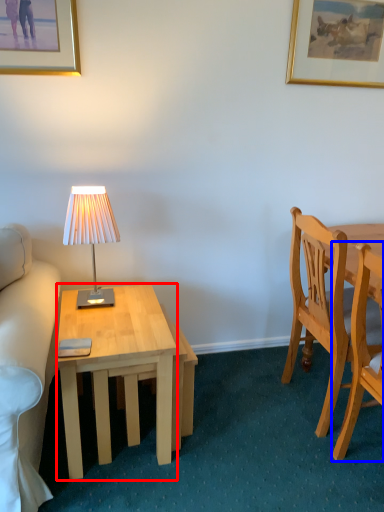
Question: Among these objects, which one is farthest to the camera, desk (highlighted by a red box) or chair (highlighted by a blue box)?

Choices:
 (A) desk
 (B) chair

Answer: (A)